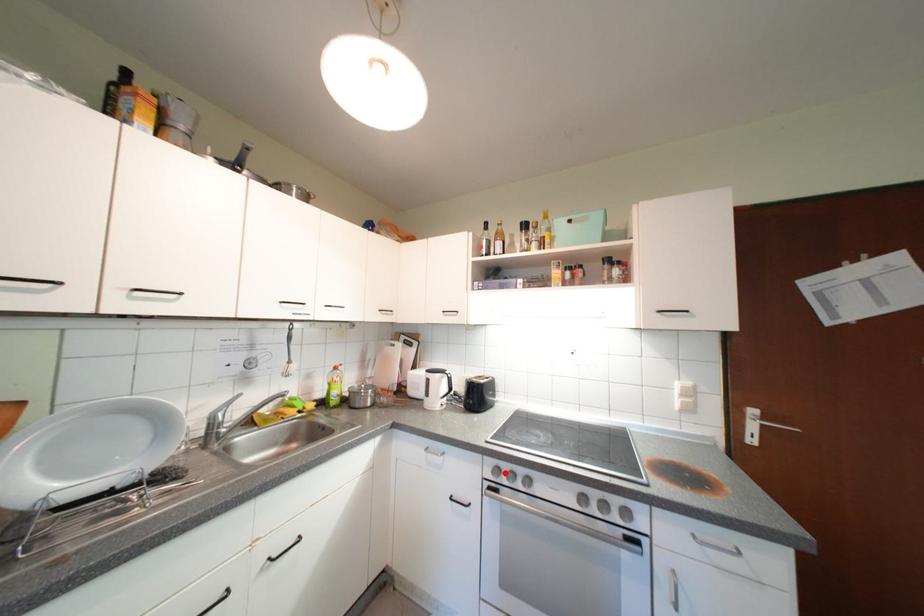
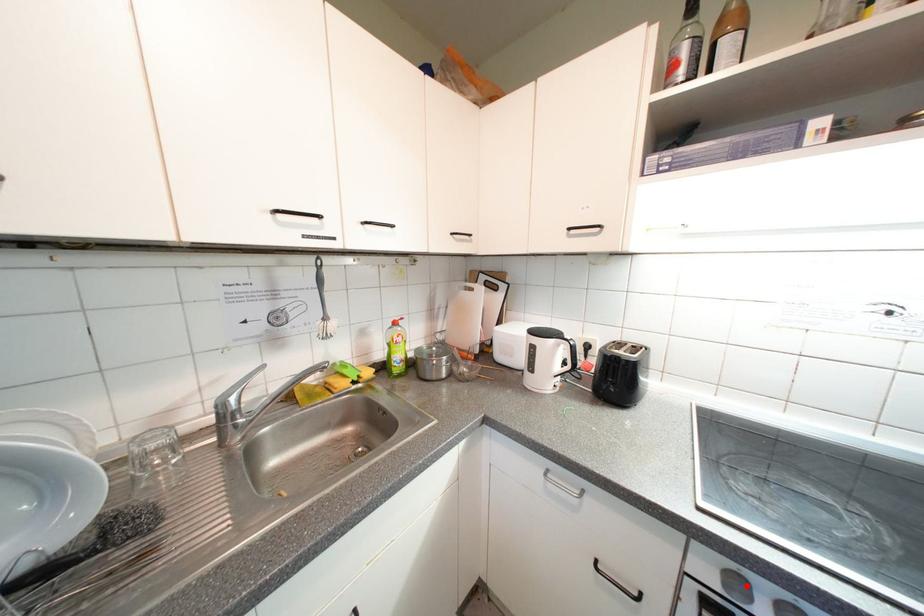
I am providing you with two images of the same scene from different viewpoints. A red point is marked on the first image and another point is marked on the second image. Is the red point in image1 aligned with the point shown in image2?

Yes